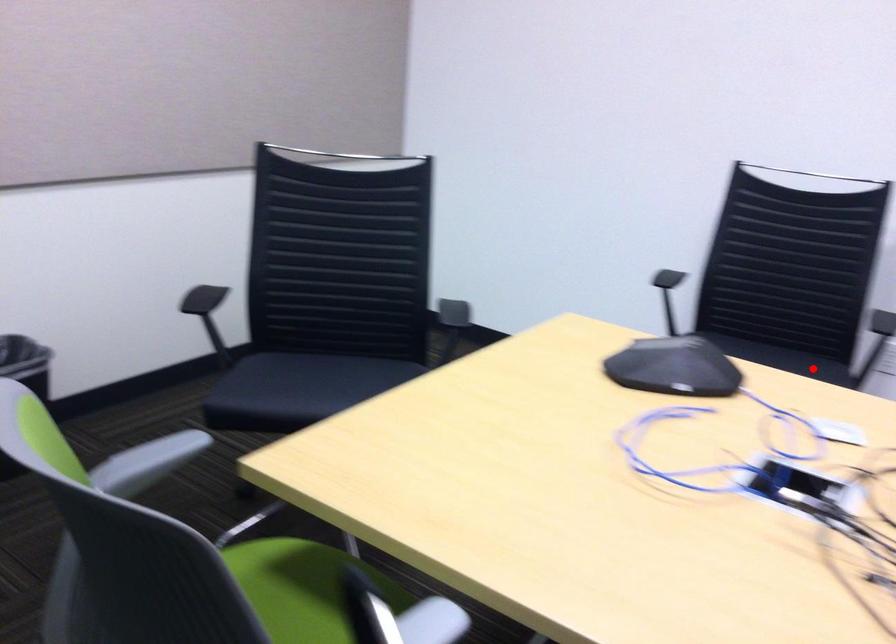
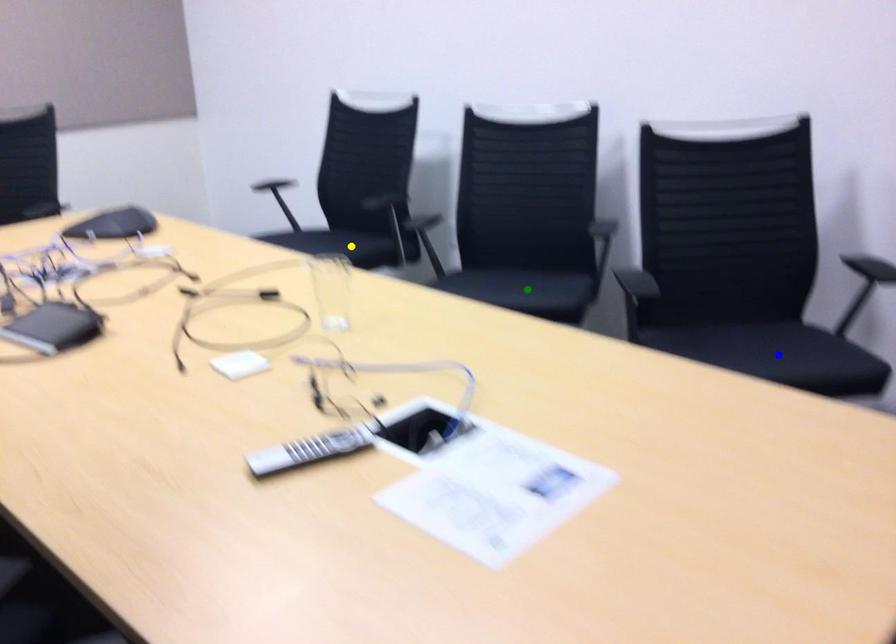
Question: I am providing you with two images of the same scene from different viewpoints. A red point is marked on the first image. You are given multiple points on the second image. Which point in image 2 represents the same 3d spot as the red point in image 1?

Choices:
 (A) blue point
 (B) green point
 (C) yellow point

Answer: (C)